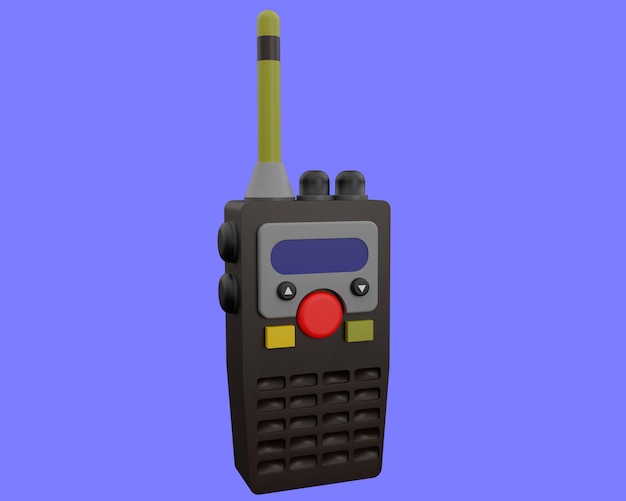
At what (x,y) coordinates should I click in order to perform the action: click on display. Please return your answer as a coordinate pair (x, y). Looking at the image, I should click on [x=322, y=259].